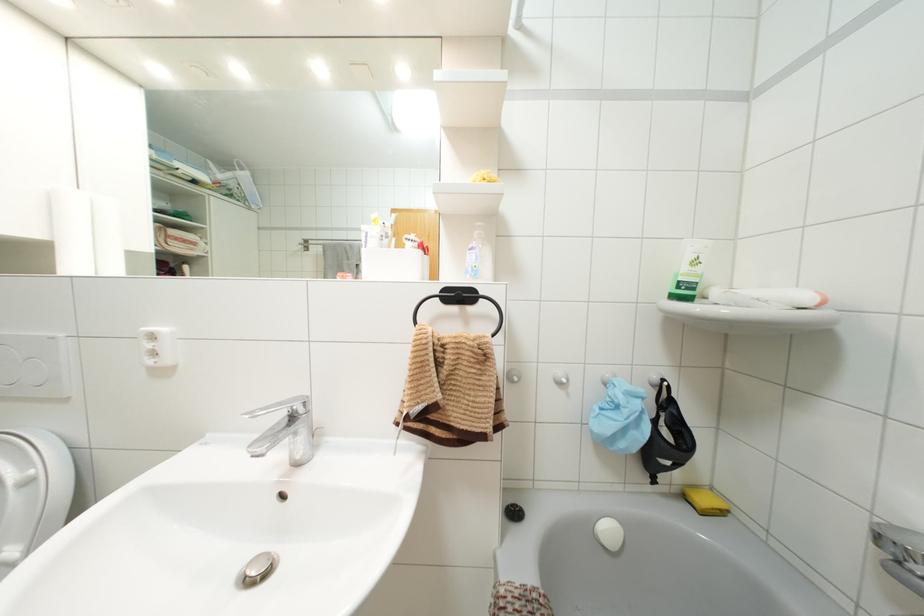
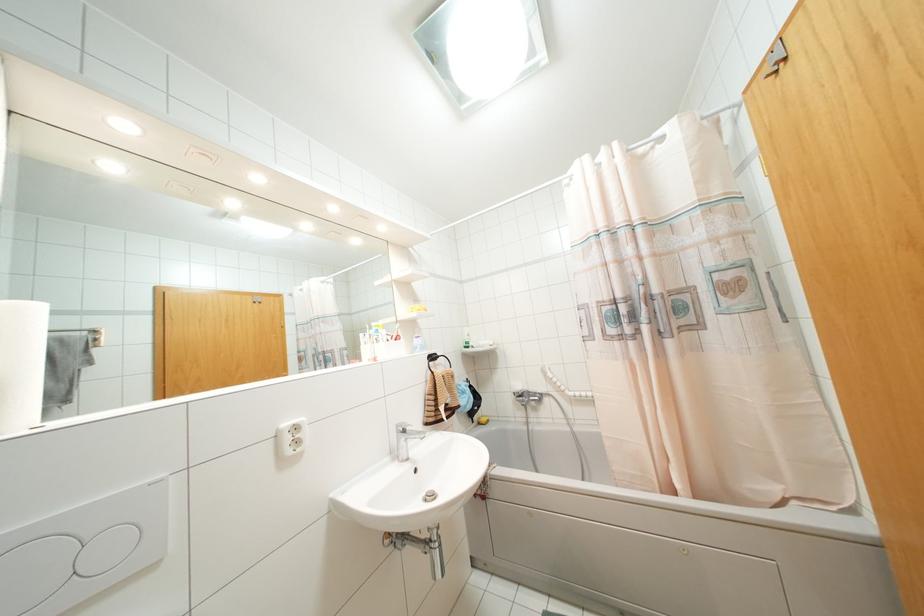
In the second image, find the point that corresponds to pixel 695 262 in the first image.

(468, 334)